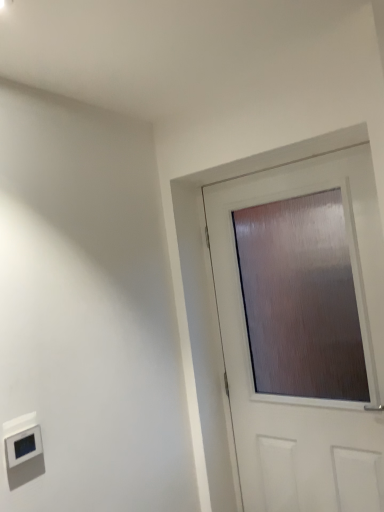
Question: Considering the relative sizes of matte white thermostat at lower left and matte brown door at center in the image provided, is matte white thermostat at lower left shorter than matte brown door at center?

Choices:
 (A) no
 (B) yes

Answer: (B)

Question: Does matte white thermostat at lower left have a greater width compared to matte brown door at center?

Choices:
 (A) yes
 (B) no

Answer: (A)

Question: From the image's perspective, is matte white thermostat at lower left located above matte brown door at center?

Choices:
 (A) yes
 (B) no

Answer: (B)

Question: From the image's perspective, would you say matte white thermostat at lower left is shown under matte brown door at center?

Choices:
 (A) no
 (B) yes

Answer: (B)

Question: Is matte white thermostat at lower left looking in the opposite direction of matte brown door at center?

Choices:
 (A) yes
 (B) no

Answer: (B)

Question: Is matte white thermostat at lower left smaller than matte brown door at center?

Choices:
 (A) yes
 (B) no

Answer: (A)

Question: Considering the relative sizes of matte brown door at center and matte white thermostat at lower left in the image provided, is matte brown door at center wider than matte white thermostat at lower left?

Choices:
 (A) no
 (B) yes

Answer: (A)

Question: From the image's perspective, does matte brown door at center appear lower than matte white thermostat at lower left?

Choices:
 (A) yes
 (B) no

Answer: (B)

Question: Can you confirm if matte brown door at center is smaller than matte white thermostat at lower left?

Choices:
 (A) yes
 (B) no

Answer: (B)

Question: Is the position of matte brown door at center less distant than that of matte white thermostat at lower left?

Choices:
 (A) no
 (B) yes

Answer: (A)

Question: Is matte brown door at center turned away from matte white thermostat at lower left?

Choices:
 (A) yes
 (B) no

Answer: (B)

Question: Does matte brown door at center have a larger size compared to matte white thermostat at lower left?

Choices:
 (A) yes
 (B) no

Answer: (A)

Question: Is matte brown door at center spatially inside matte white thermostat at lower left, or outside of it?

Choices:
 (A) inside
 (B) outside

Answer: (B)